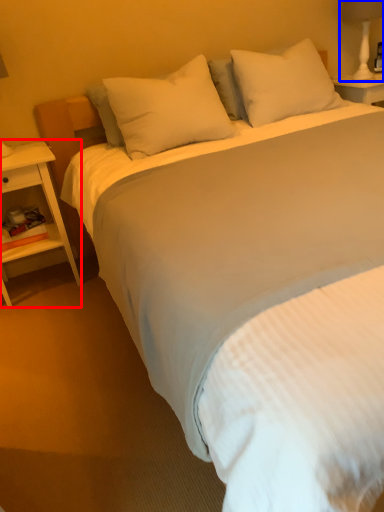
Question: Which object appears farthest to the camera in this image, nightstand (highlighted by a red box) or bedside lamp (highlighted by a blue box)?

Choices:
 (A) nightstand
 (B) bedside lamp

Answer: (B)